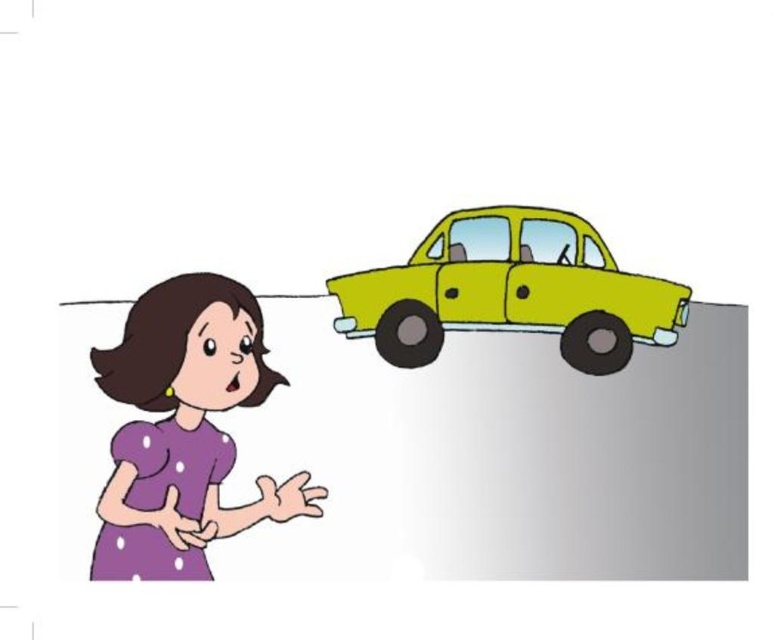
Question: From the image, what is the correct spatial relationship of purple dotted dress at lower left in relation to yellow matte car at upper right?

Choices:
 (A) below
 (B) above

Answer: (A)

Question: Among these objects, which one is nearest to the camera?

Choices:
 (A) yellow matte car at upper right
 (B) purple dotted dress at lower left

Answer: (B)

Question: Does purple dotted dress at lower left have a larger size compared to yellow matte car at upper right?

Choices:
 (A) no
 (B) yes

Answer: (B)

Question: Is purple dotted dress at lower left to the right of yellow matte car at upper right from the viewer's perspective?

Choices:
 (A) yes
 (B) no

Answer: (B)

Question: Which of the following is the farthest from the observer?

Choices:
 (A) purple dotted dress at lower left
 (B) yellow matte car at upper right

Answer: (B)